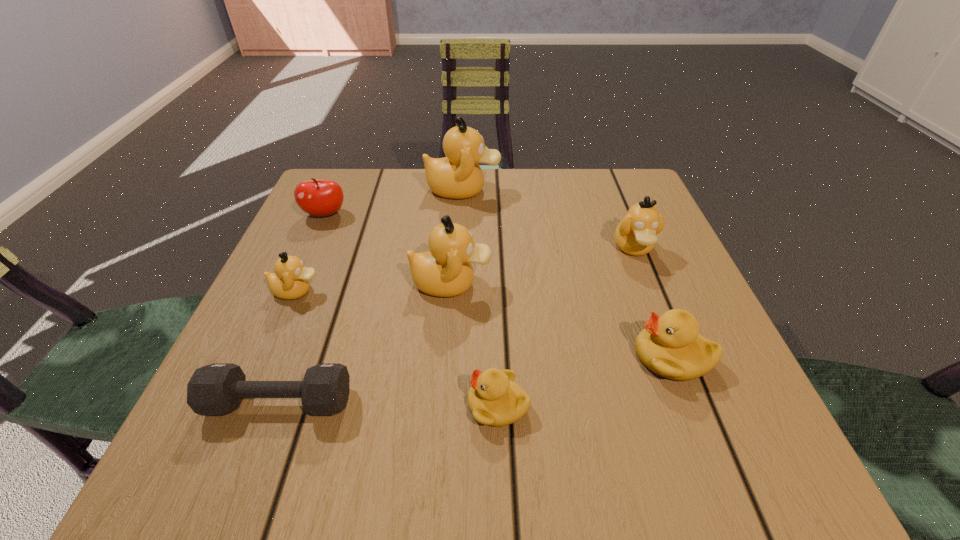
Where is `the farthest object`? The width and height of the screenshot is (960, 540). the farthest object is located at coordinates (458, 175).

Locate an element on the screen. The image size is (960, 540). the tallest duckling is located at coordinates (458, 175).

Identify the location of the seventh shortest object. This screenshot has width=960, height=540. (445, 271).

Where is `the second tallest duckling`? This screenshot has width=960, height=540. the second tallest duckling is located at coordinates (445, 271).

Where is `the rightmost tan duckling`? the rightmost tan duckling is located at coordinates (636, 233).

The height and width of the screenshot is (540, 960). In order to click on the sixth shortest object in this screenshot , I will do `click(636, 233)`.

You are a GUI agent. You are given a task and a screenshot of the screen. Output one action in this format:
    pyautogui.click(x=<x>, y=<y>)
    Task: Click on the apple
    The height and width of the screenshot is (540, 960).
    Given the screenshot: What is the action you would take?
    pyautogui.click(x=315, y=197)

This screenshot has height=540, width=960. I want to click on the bigger yellow duckling, so click(670, 345).

Image resolution: width=960 pixels, height=540 pixels. Identify the location of the leftmost tan duckling. (290, 281).

You are a GUI agent. You are given a task and a screenshot of the screen. Output one action in this format:
    pyautogui.click(x=<x>, y=<y>)
    Task: Click on the smallest tan duckling
    This screenshot has width=960, height=540.
    Given the screenshot: What is the action you would take?
    pyautogui.click(x=290, y=281)